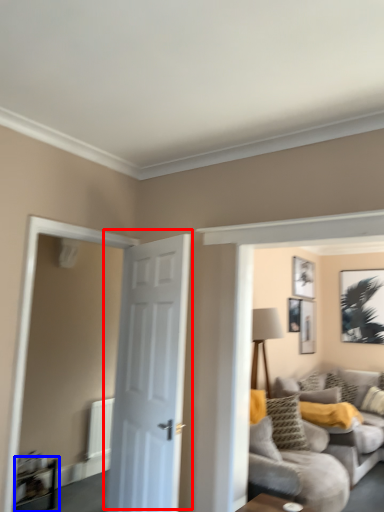
Question: Which of the following is the farthest to the observer, door (highlighted by a red box) or table (highlighted by a blue box)?

Choices:
 (A) door
 (B) table

Answer: (B)